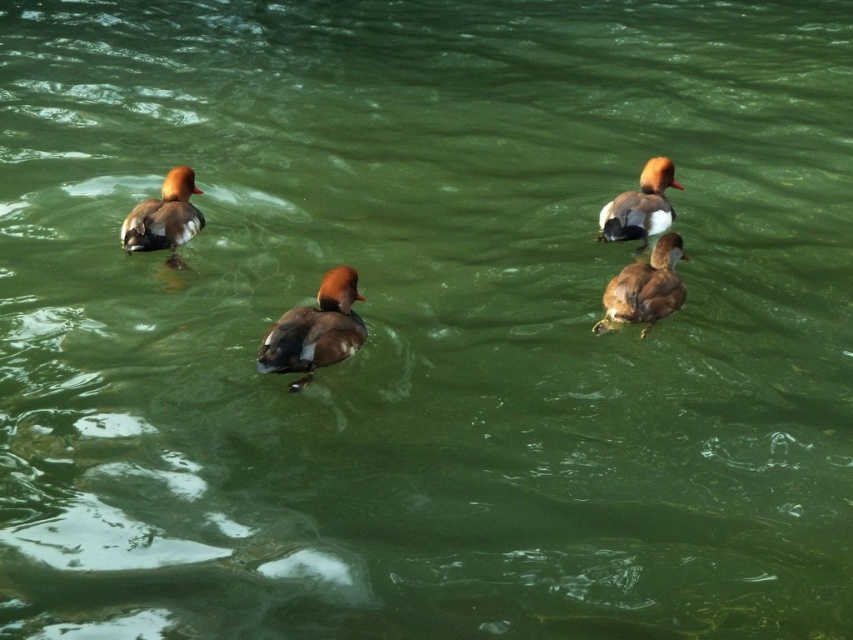
Is brown matte duck at center to the right of brown glossy duck at upper right from the viewer's perspective?

In fact, brown matte duck at center is to the left of brown glossy duck at upper right.

Where is `brown matte duck at center`? brown matte duck at center is located at coordinates (643, 288).

The width and height of the screenshot is (853, 640). What are the coordinates of `brown matte duck at center` in the screenshot? It's located at (643, 288).

Does brown glossy duck at center have a lesser width compared to brown glossy duck at upper right?

Correct, brown glossy duck at center's width is less than brown glossy duck at upper right's.

Consider the image. Who is more forward, (344, 328) or (656, 214)?

Point (344, 328) is in front.

This screenshot has width=853, height=640. Find the location of `brown glossy duck at center`. brown glossy duck at center is located at coordinates (315, 330).

Is brown glossy duck at center thinner than brown matte duck at center?

Yes.

Can you confirm if brown glossy duck at center is positioned to the right of brown matte duck at center?

Incorrect, brown glossy duck at center is not on the right side of brown matte duck at center.

Describe the element at coordinates (315, 330) in the screenshot. The width and height of the screenshot is (853, 640). I see `brown glossy duck at center` at that location.

What are the coordinates of `brown glossy duck at center` in the screenshot? It's located at (315, 330).